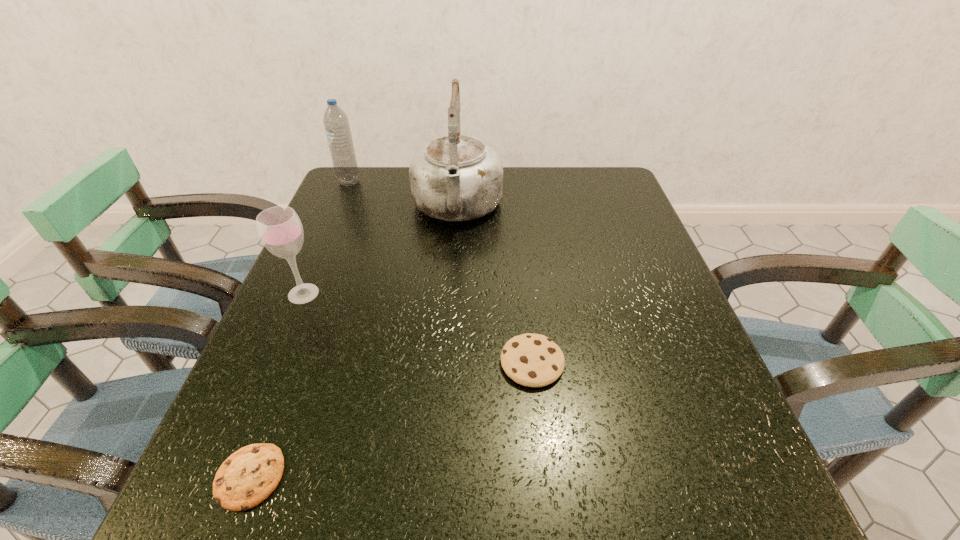
You are a GUI agent. You are given a task and a screenshot of the screen. Output one action in this format:
    pyautogui.click(x=<x>, y=<y>)
    Task: Click on the vacant space that's between the second tallest object and the tallest object
    
    Given the screenshot: What is the action you would take?
    pyautogui.click(x=403, y=195)

Identify the location of vacant region between the third tallest object and the shorter cookie. (276, 385).

I want to click on blank region between the farther cookie and the nearest object, so click(x=391, y=420).

This screenshot has height=540, width=960. Find the location of `vacant space that is in between the taller cookie and the kettle`. vacant space that is in between the taller cookie and the kettle is located at coordinates (494, 286).

Where is `unoccupied area between the second tallest object and the kettle`? unoccupied area between the second tallest object and the kettle is located at coordinates (403, 195).

At what (x,y) coordinates should I click in order to perform the action: click on free space between the third farthest object and the tallest object. Please return your answer as a coordinate pair (x, y). This screenshot has width=960, height=540. Looking at the image, I should click on click(x=380, y=251).

Locate an element on the screen. The width and height of the screenshot is (960, 540). empty space that is in between the second shortest object and the wineglass is located at coordinates (418, 328).

Identify the location of vacant space that's between the water bottle and the third shortest object. The width and height of the screenshot is (960, 540). (326, 238).

The height and width of the screenshot is (540, 960). Identify the location of free space between the third farthest object and the water bottle. (326, 238).

Identify which object is located as the third nearest to the kettle. Please provide its 2D coordinates. Your answer should be formatted as a tuple, i.e. [(x, y)], where the tuple contains the x and y coordinates of a point satisfying the conditions above.

[(533, 360)]